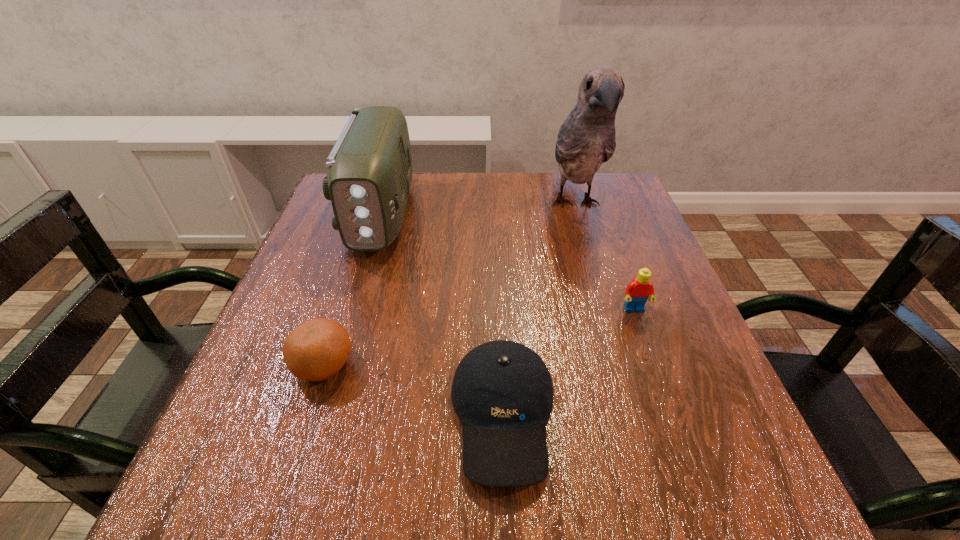
Locate an element on the screen. The image size is (960, 540). the tallest object is located at coordinates (586, 139).

This screenshot has height=540, width=960. In order to click on the second tallest object in this screenshot , I will do `click(369, 175)`.

Image resolution: width=960 pixels, height=540 pixels. What are the coordinates of `the third nearest object` in the screenshot? It's located at (637, 292).

Identify the location of baseball cap. (502, 392).

Find the location of a particular element. clementine is located at coordinates (316, 350).

Locate an element on the screen. free space located on the front-facing side of the tallest object is located at coordinates (610, 321).

The image size is (960, 540). Find the location of `free space located 0.180m on the front-facing side of the radio_receiver`. free space located 0.180m on the front-facing side of the radio_receiver is located at coordinates [349, 321].

Identify the location of free point located on the face of the Lego. (669, 409).

At what (x,y) coordinates should I click in order to perform the action: click on vacant area situated on the back of the clementine. Please return your answer as a coordinate pair (x, y). This screenshot has width=960, height=540. Looking at the image, I should click on (363, 242).

Where is `parrot present at the far edge`? This screenshot has height=540, width=960. parrot present at the far edge is located at coordinates (586, 139).